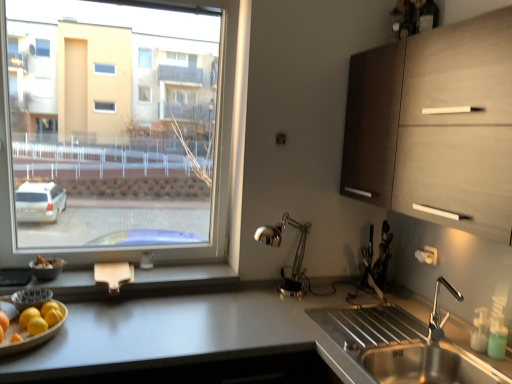
Identify the location of vacant space to the right of wooden tray with fruits at lower left. (106, 338).